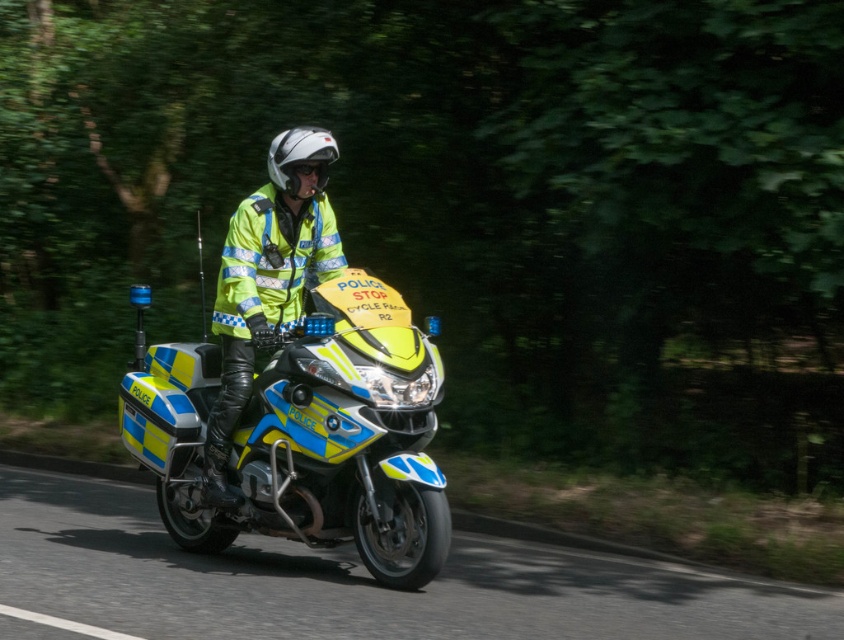
You are a traffic officer who needs to position your motorcycle precisely for a roadblock. The motorcycle must be placed at coordinates exactly at point 0.681, 0.366. Can you confirm if the blue and yellow plastic motorcycle at center is already positioned correctly?

Yes, the blue and yellow plastic motorcycle at center is already positioned correctly at coordinates exactly at point (307, 435).